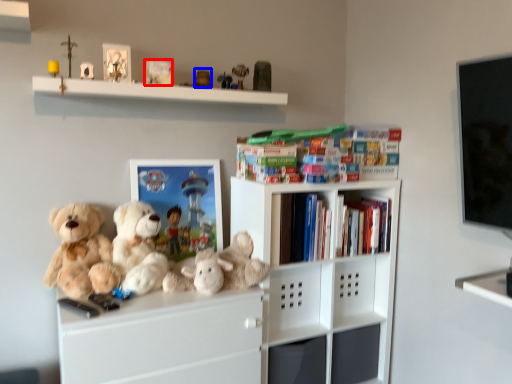
Question: Which object appears farthest to the camera in this image, book (highlighted by a red box) or toy (highlighted by a blue box)?

Choices:
 (A) book
 (B) toy

Answer: (B)